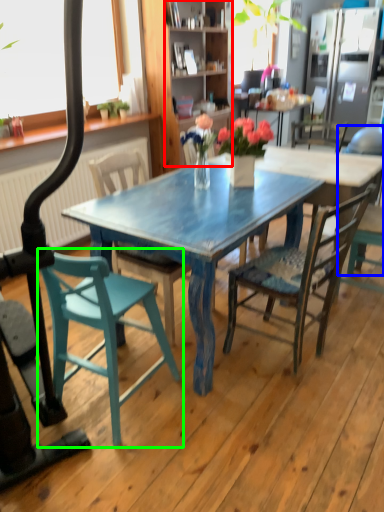
Question: Considering the real-world distances, which object is closest to cabinetry (highlighted by a red box)? chair (highlighted by a blue box) or chair (highlighted by a green box).

Choices:
 (A) chair
 (B) chair

Answer: (A)